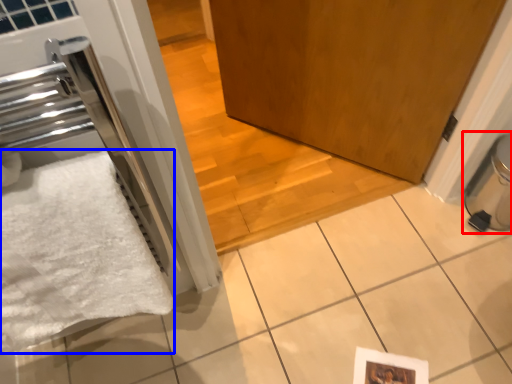
Question: Which of the following is the farthest to the observer, water heater (highlighted by a red box) or bath towel (highlighted by a blue box)?

Choices:
 (A) water heater
 (B) bath towel

Answer: (A)